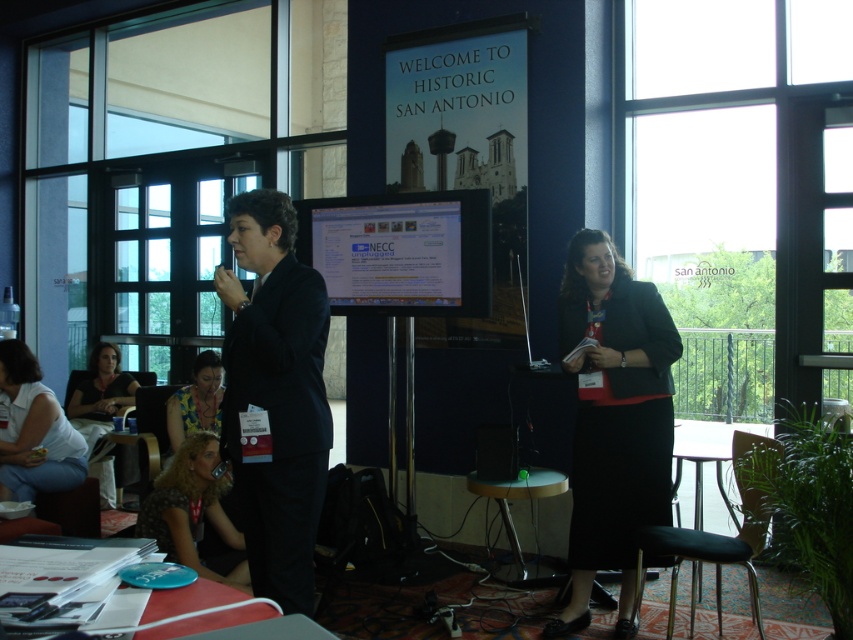
Based on the photo, you are standing in the conference room and want to move from point A to point B. Point A is at coordinate point (247, 394) and point B is at coordinate point (19, 456). Which point is closer to you when you first enter the room?

Point A at coordinate point (247, 394) is closer to the viewer than point B at coordinate point (19, 456).

You are organizing a photo shoot and need to place a large camera tripod between the black suit at center and the matte black shirt at lower left. Given that the tripod requires a minimum of 1 meter of space, can you fit it between them?

The black suit at center is smaller than the matte black shirt at lower left, but the description does not provide information about the distance between them. Therefore, it is impossible to determine if the tripod can fit between them based on the given details.

You are attending a presentation in the conference room and notice two items of clothing in the scene. The first is the black fabric skirt at right, and the second is the matte black shirt at lower left. Which of these items is taller in the image?

The black fabric skirt at right is much taller as the matte black shirt at lower left.